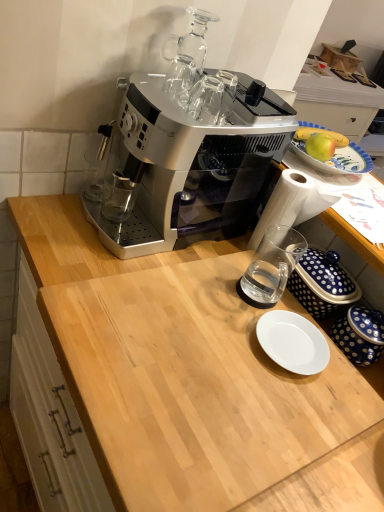
Identify the location of free point to the right of transparent glass cups at upper center. The height and width of the screenshot is (512, 384). (238, 102).